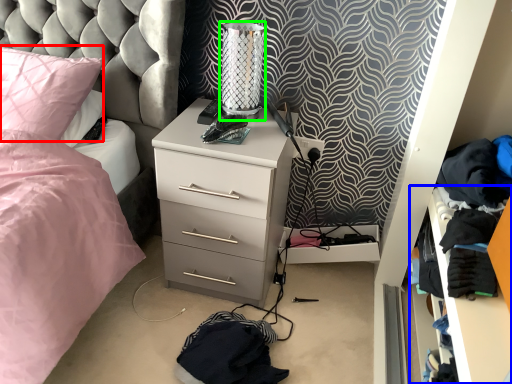
Question: Based on their relative distances, which object is farther from pillow (highlighted by a red box)? Choose from shelf (highlighted by a blue box) and table lamp (highlighted by a green box).

Choices:
 (A) shelf
 (B) table lamp

Answer: (A)